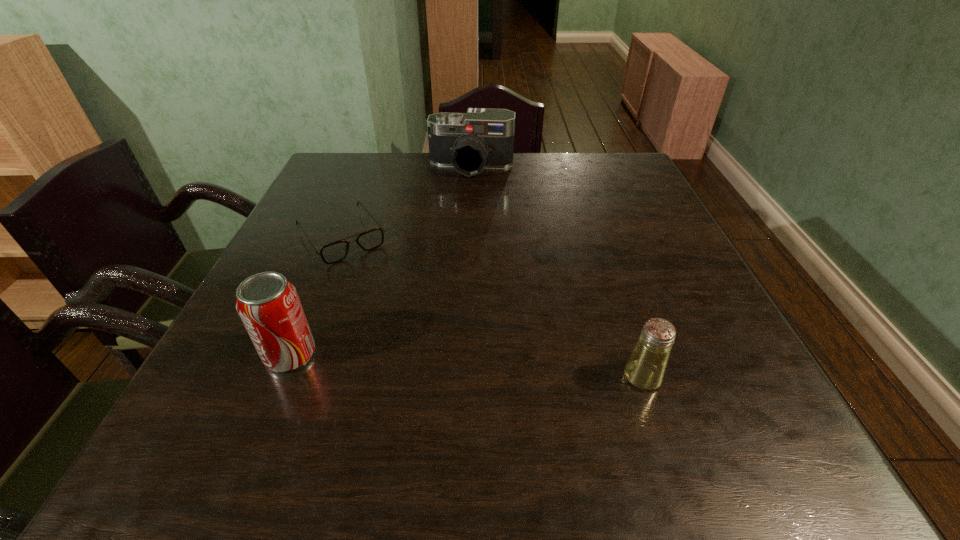
This screenshot has height=540, width=960. In order to click on vacant spot on the desktop that is between the soda can and the third tallest object and is positioned on the front-facing side of the sunglasses in this screenshot , I will do `click(435, 364)`.

Find the location of `vacant space on the desktop that is between the soda can and the saltshaker and is positioned on the front-facing side of the camera`. vacant space on the desktop that is between the soda can and the saltshaker and is positioned on the front-facing side of the camera is located at coordinates (430, 363).